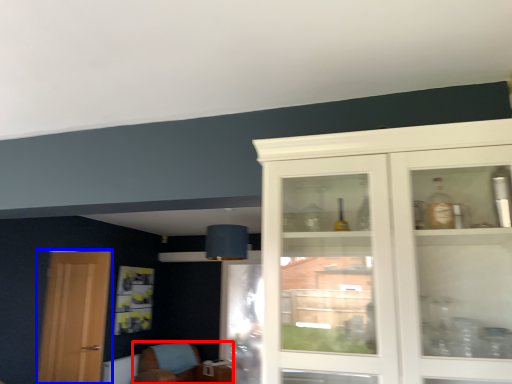
Question: Which of the following is the farthest to the observer, chair (highlighted by a red box) or door (highlighted by a blue box)?

Choices:
 (A) chair
 (B) door

Answer: (A)